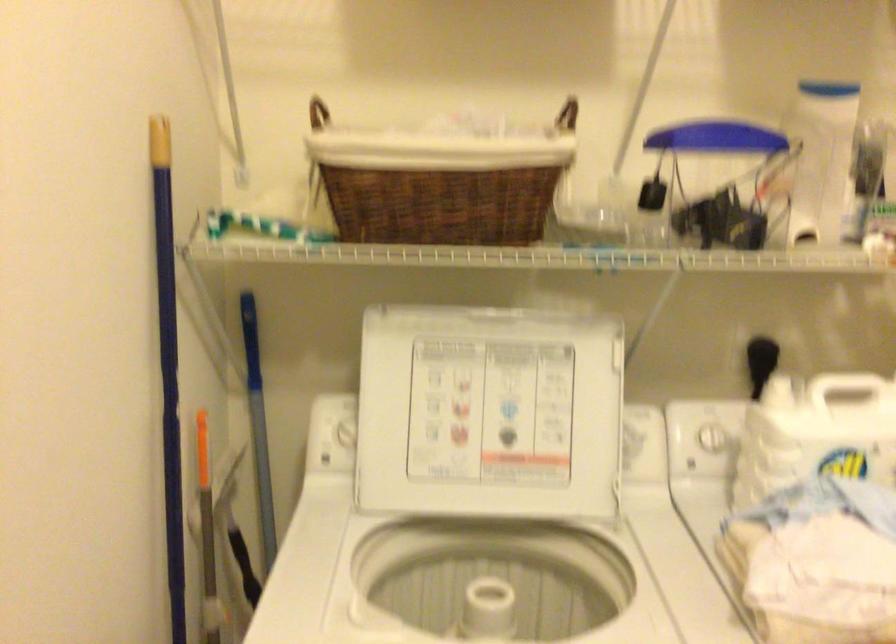
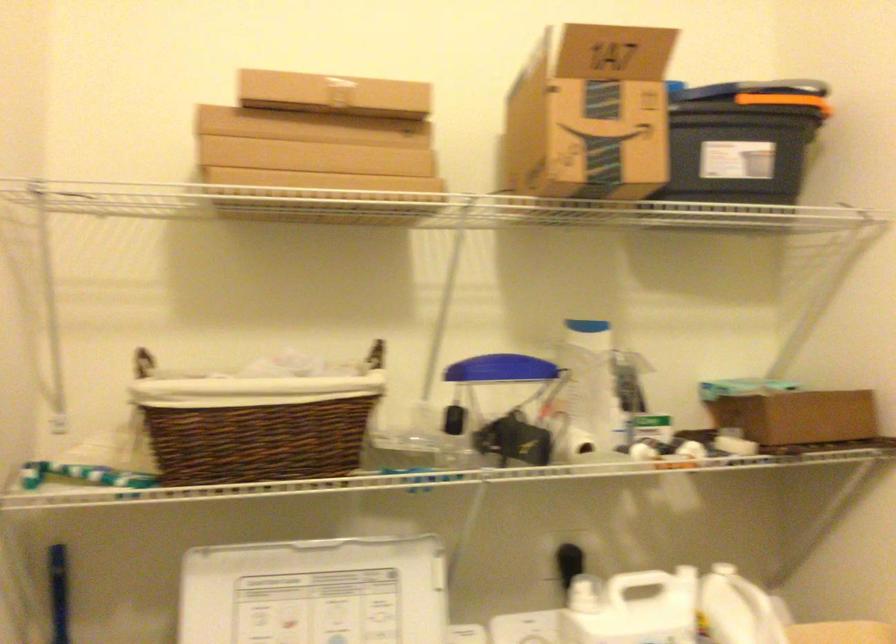
Question: Which direction would the cameraman need to move to produce the second image? Reply with the corresponding letter.

Choices:
 (A) Left
 (B) Right
 (C) Forward
 (D) Backward

Answer: (D)